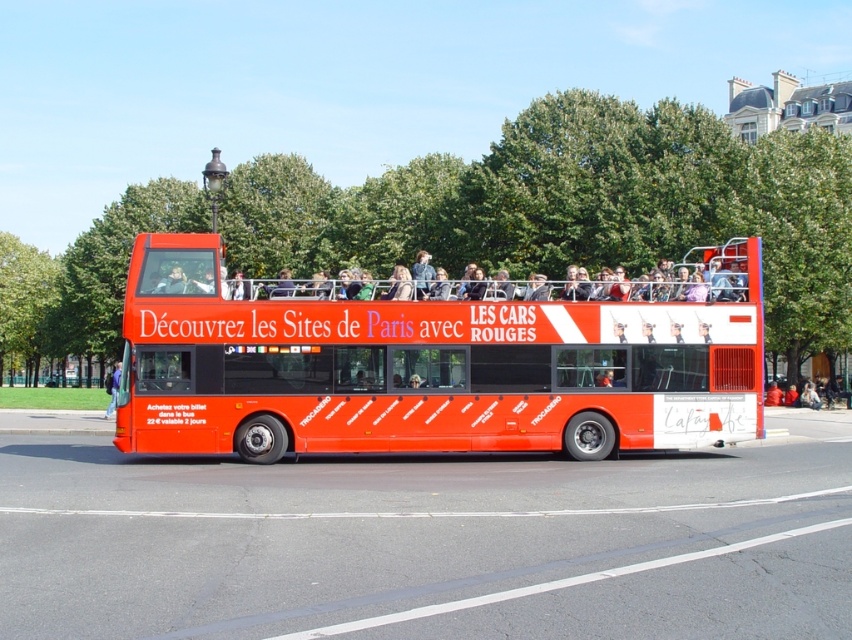
Based on the photo, you are a photographer planning to take a photo of the shiny red bus at center and the green leafy tree at center. If you want to ensure both fit in the frame, which object should you focus on to avoid cropping either?

The green leafy tree at center is wider than the shiny red bus at center, so you should focus on the green leafy tree at center to ensure it fits entirely in the frame without cropping.

You are a photographer planning to capture both the shiny red bus at center and the green leafy tree at left in a single frame. Based on their sizes in the image, which object would appear larger in your photo?

The green leafy tree at left appears larger in the image than the shiny red bus at center.

You are a tourist standing on the sidewalk next to the road where the red double decker bus is parked. You want to take a photo of the bus with both the green leafy tree at center and the green leafy tree at left in the background. Which tree should you position closer to the bus to include both in your photo?

You should position the green leafy tree at center closer to the bus because it is bigger than the green leafy tree at left, making it more visible in the photo.